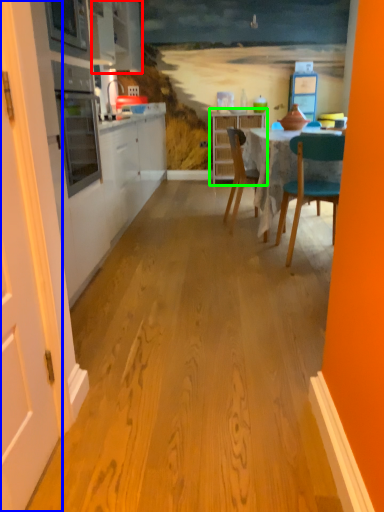
Question: Estimate the real-world distances between objects in this image. Which object is farther from cabinetry (highlighted by a red box), door (highlighted by a blue box) or cabinetry (highlighted by a green box)?

Choices:
 (A) door
 (B) cabinetry

Answer: (A)